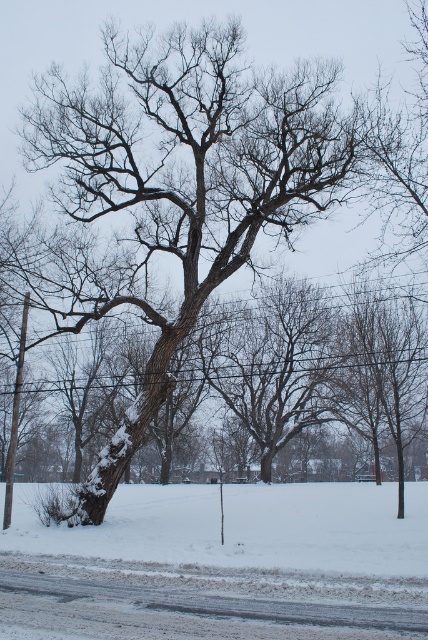
You are standing in the winter scene described. You see a point marked at coordinates (178,186). What object is located at that point?

The point at coordinates (178,186) indicates the snow covered bark tree at center.